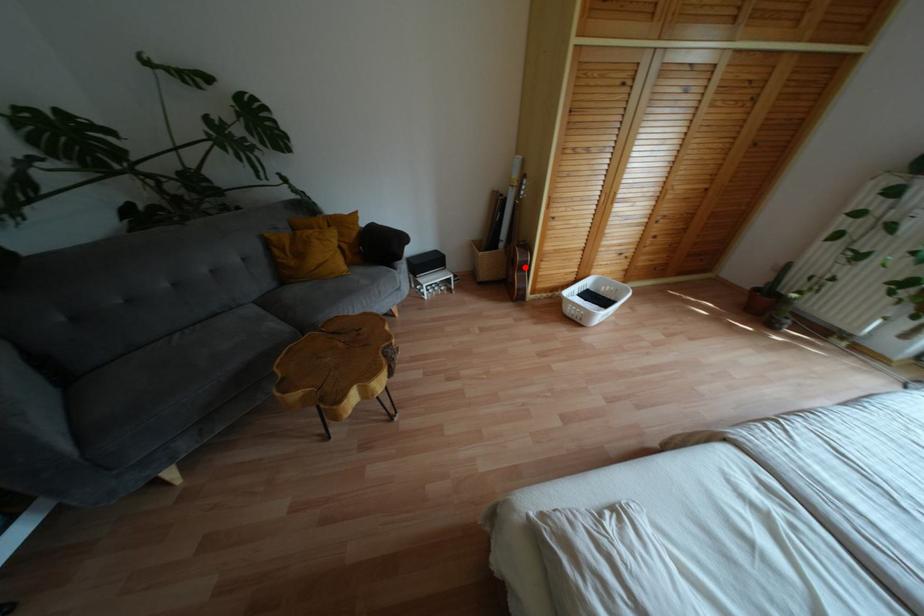
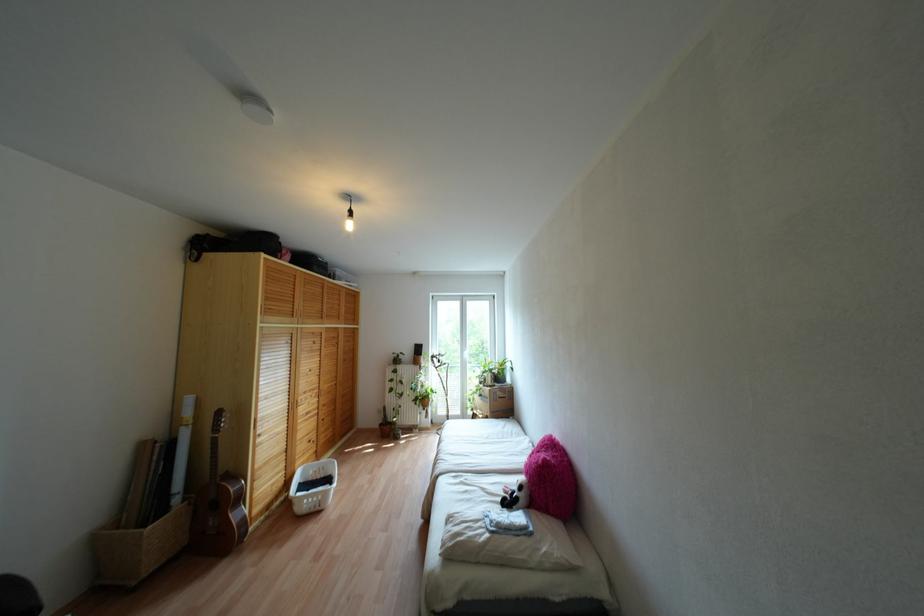
Where in the second image is the point corresponding to the highlighted location from the first image?

(238, 498)